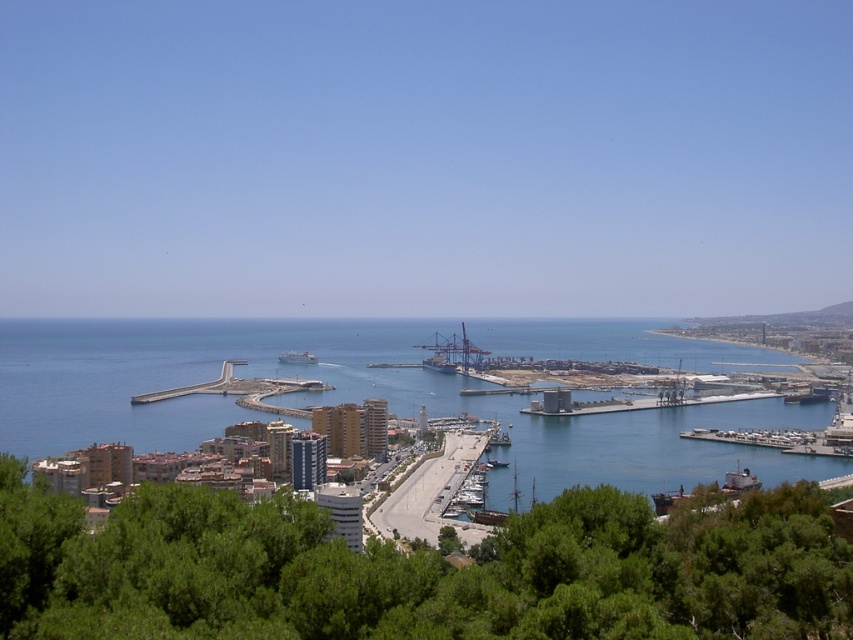
You are a delivery drone that needs to fly from the gray concrete dock at center to the blue water at center. What is the shortest distance you must travel?

The shortest distance between the gray concrete dock at center and the blue water at center is 75.85 meters.